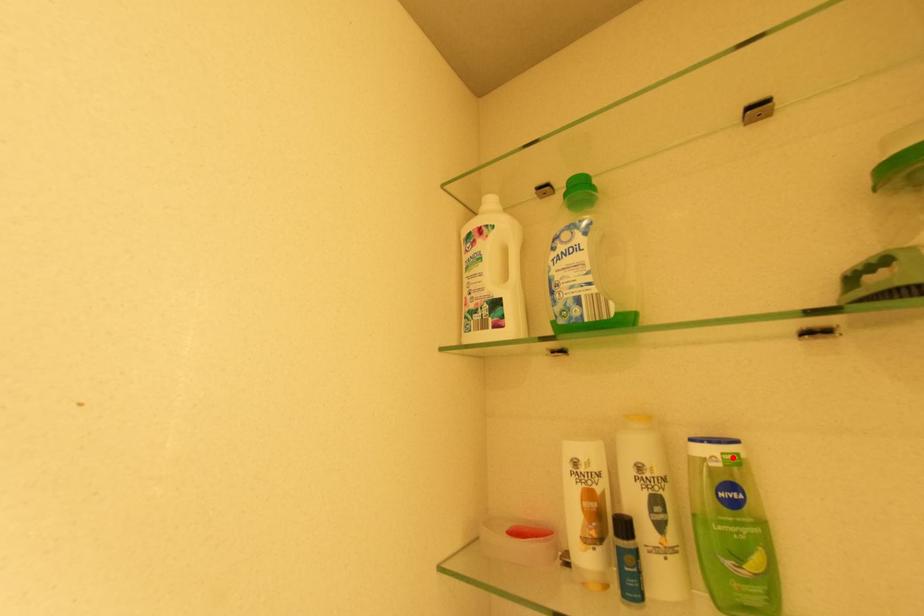
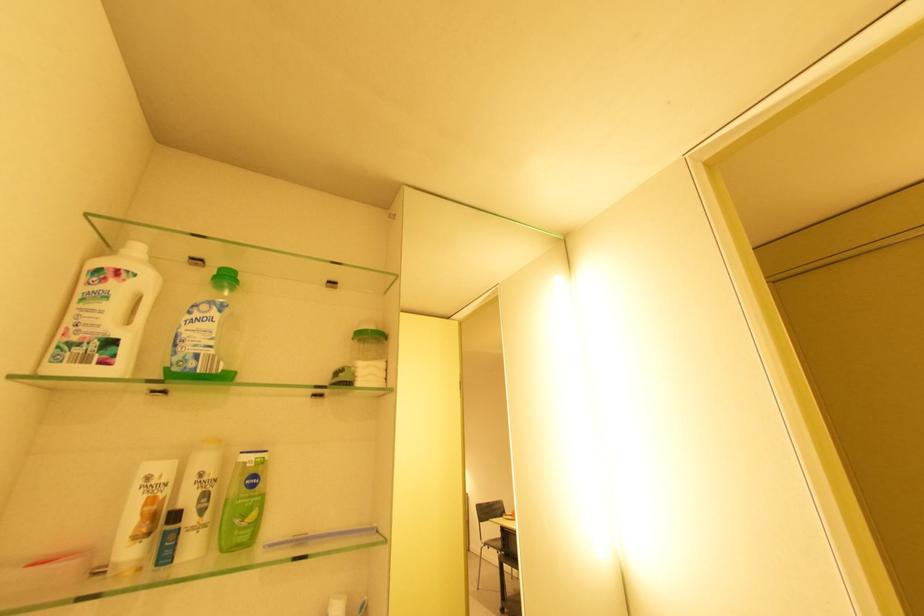
Locate, in the second image, the point that corresponds to the highlighted location in the first image.

(262, 460)